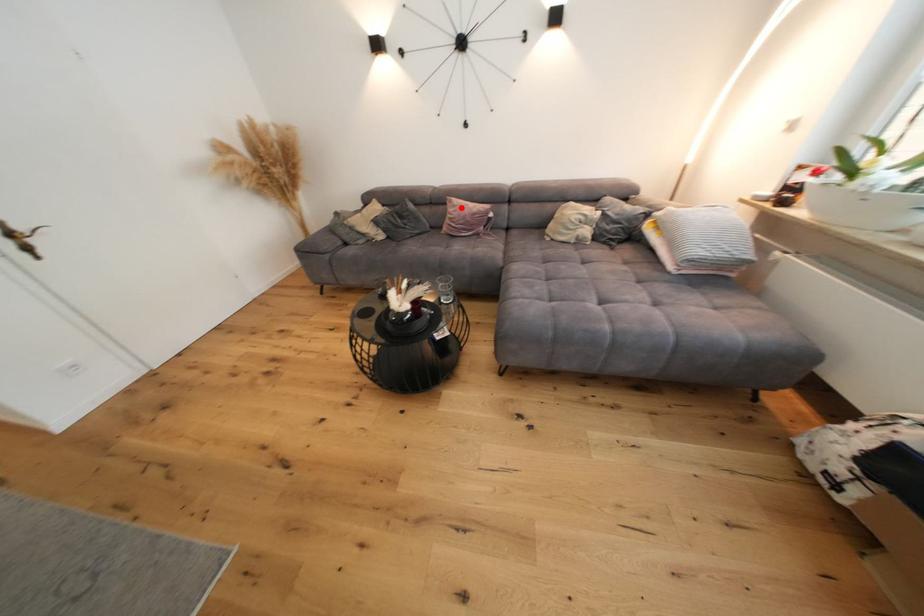
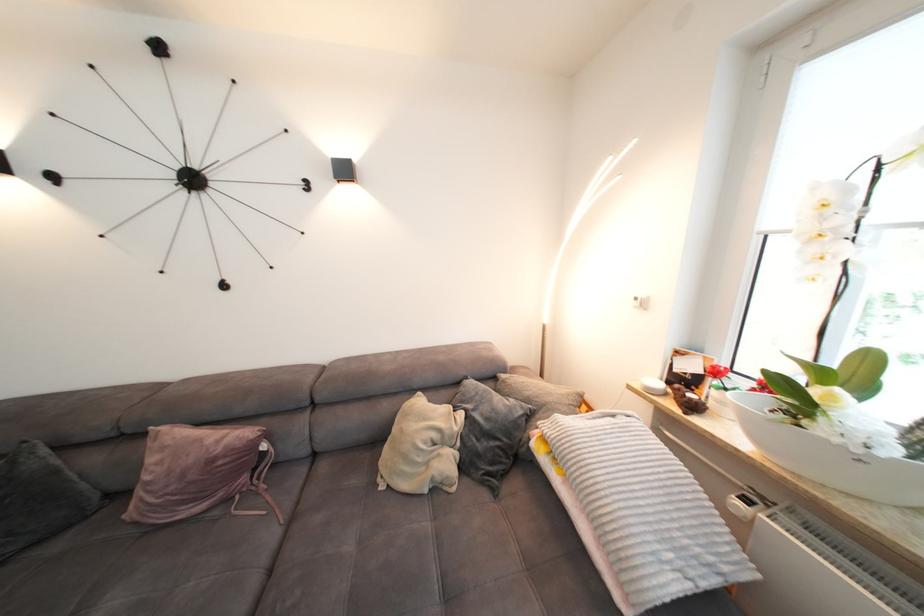
Question: I am providing you with two images of the same scene from different viewpoints. In image1, a red point is highlighted. Considering the same 3D point in image2, which of the following is correct?

Choices:
 (A) It is closer
 (B) It is farther

Answer: (B)